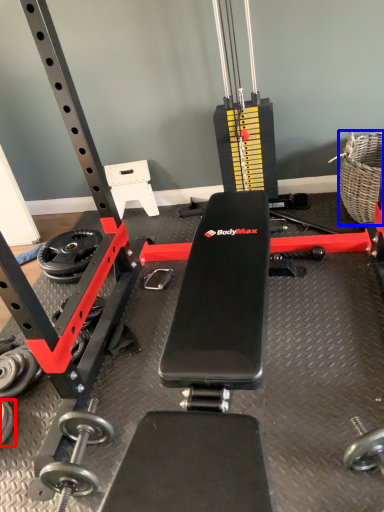
Question: Which object appears closest to the camera in this image, dumbbell (highlighted by a red box) or basket (highlighted by a blue box)?

Choices:
 (A) dumbbell
 (B) basket

Answer: (A)